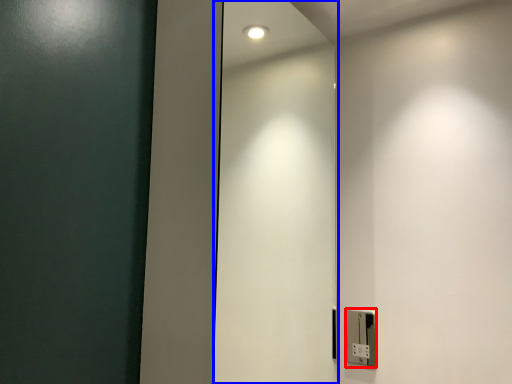
Question: Which of the following is the farthest to the observer, light switch (highlighted by a red box) or elevator door (highlighted by a blue box)?

Choices:
 (A) light switch
 (B) elevator door

Answer: (A)